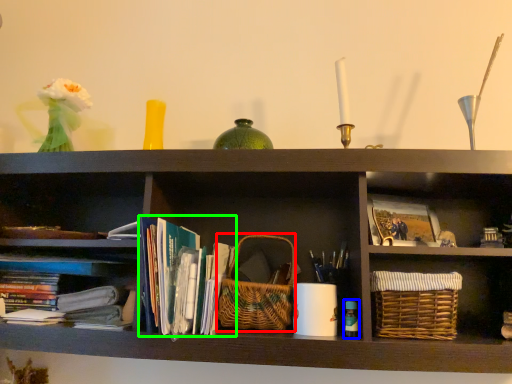
Question: Estimate the real-world distances between objects in this image. Which object is farther from basket (highlighted by a red box), bottle (highlighted by a blue box) or book (highlighted by a green box)?

Choices:
 (A) bottle
 (B) book

Answer: (A)